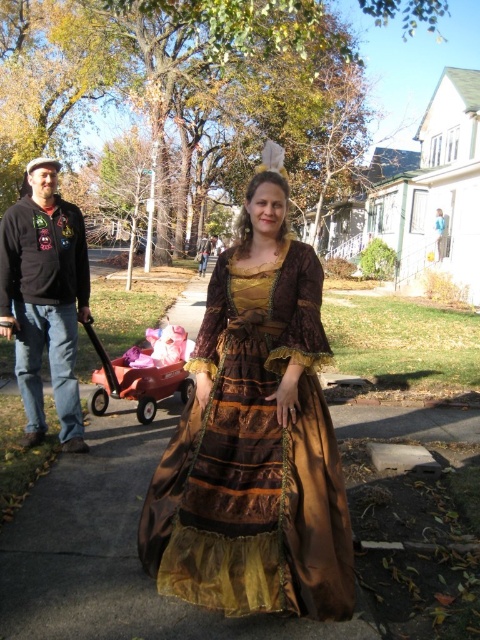
Question: Which point is closer to the camera?

Choices:
 (A) orange plastic wagon at lower left
 (B) matte black jacket at left

Answer: (B)

Question: Which of the following is the farthest from the observer?

Choices:
 (A) (269, 529)
 (B) (29, 330)
 (C) (101, 410)

Answer: (C)

Question: From the image, what is the correct spatial relationship of shiny brown fabric dress at center in relation to matte black jacket at left?

Choices:
 (A) right
 (B) left

Answer: (A)

Question: Which object appears farthest from the camera in this image?

Choices:
 (A) matte black jacket at left
 (B) shiny brown fabric dress at center
 (C) orange plastic wagon at lower left

Answer: (C)

Question: Where is matte black jacket at left located in relation to orange plastic wagon at lower left in the image?

Choices:
 (A) left
 (B) right

Answer: (A)

Question: Can you confirm if matte black jacket at left is positioned to the left of orange plastic wagon at lower left?

Choices:
 (A) yes
 (B) no

Answer: (A)